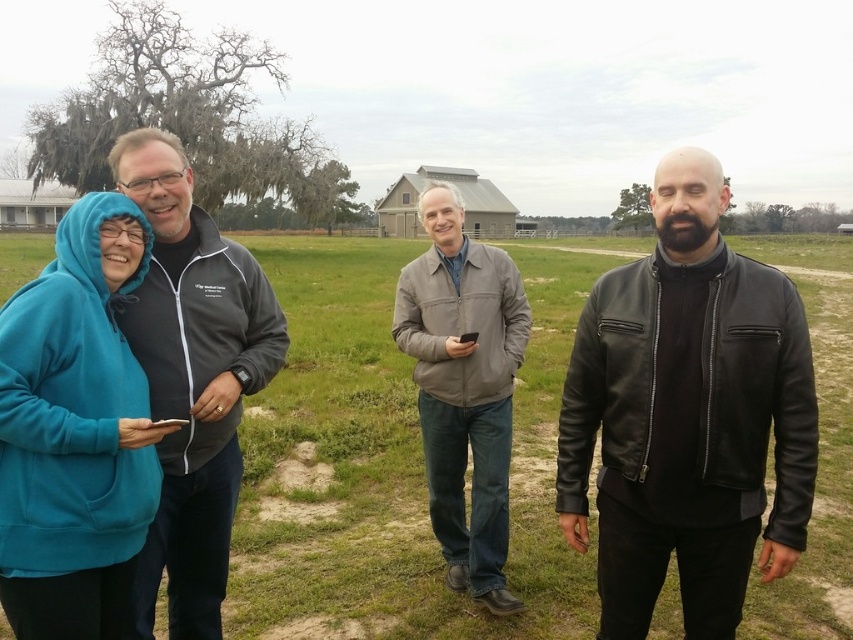
Which of these two, teal fleece at left or teal fleece hoodie at left, stands shorter?

teal fleece hoodie at left

Does teal fleece at left have a smaller size compared to teal fleece hoodie at left?

No.

The width and height of the screenshot is (853, 640). What do you see at coordinates (390, 461) in the screenshot? I see `teal fleece at left` at bounding box center [390, 461].

At what (x,y) coordinates should I click in order to perform the action: click on teal fleece at left. Please return your answer as a coordinate pair (x, y). The image size is (853, 640). Looking at the image, I should click on (390, 461).

The height and width of the screenshot is (640, 853). Find the location of `black leather jacket at right`. black leather jacket at right is located at coordinates (688, 416).

Does black leather jacket at right appear on the left side of gray leather jacket at center?

In fact, black leather jacket at right is to the right of gray leather jacket at center.

Is point (757, 330) in front of point (529, 314)?

Yes.

The image size is (853, 640). I want to click on black leather jacket at right, so click(x=688, y=416).

Based on the photo, is teal fleece at left taller than black leather jacket at right?

Correct, teal fleece at left is much taller as black leather jacket at right.

Is teal fleece at left thinner than black leather jacket at right?

No.

You are a GUI agent. You are given a task and a screenshot of the screen. Output one action in this format:
    pyautogui.click(x=<x>, y=<y>)
    Task: Click on the teal fleece at left
    Image resolution: width=853 pixels, height=640 pixels.
    Given the screenshot: What is the action you would take?
    pyautogui.click(x=390, y=461)